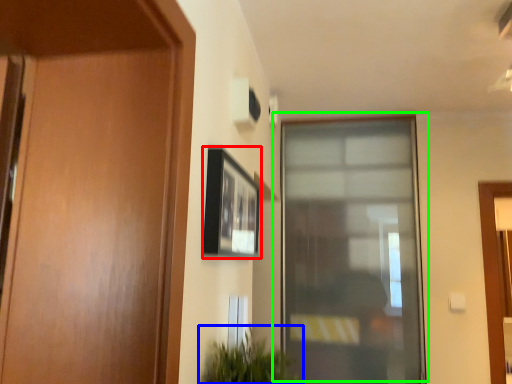
Question: Estimate the real-world distances between objects in this image. Which object is closer to picture frame (highlighted by a red box), houseplant (highlighted by a blue box) or window (highlighted by a green box)?

Choices:
 (A) houseplant
 (B) window

Answer: (A)